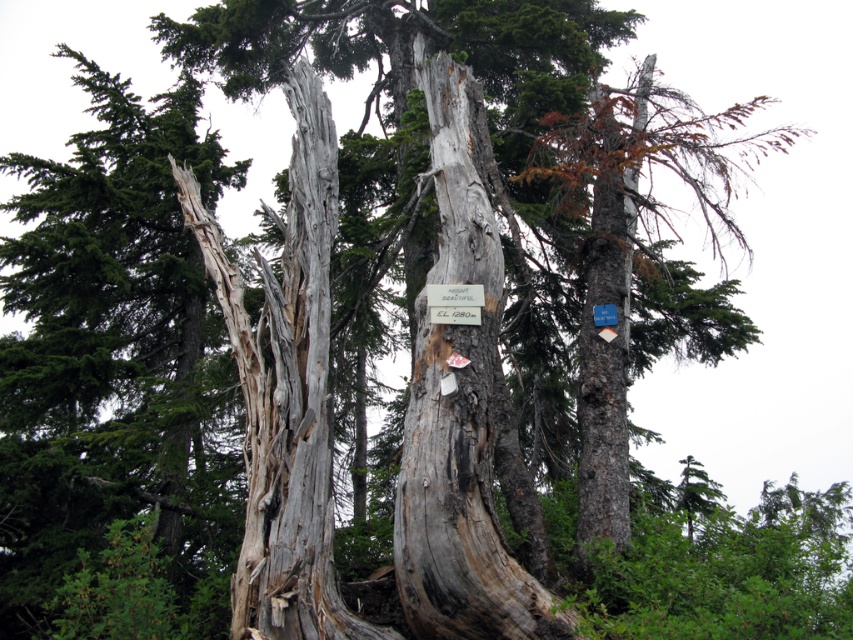
You are a hiker trying to read both the green wood sign at center and the white paper sign at center. Which sign can you see more clearly?

The green wood sign at center is in front of the white paper sign at center, so you can see the green wood sign at center more clearly.

You are a hiker with a 2 meter long measuring tape. You want to measure the distance between the gray rough bark tree trunk at center and the white paper sign at center. Can your measuring tape reach that distance?

The distance between the gray rough bark tree trunk at center and the white paper sign at center is 1.93 meters, so yes, the 2 meter long measuring tape can reach the distance between them.